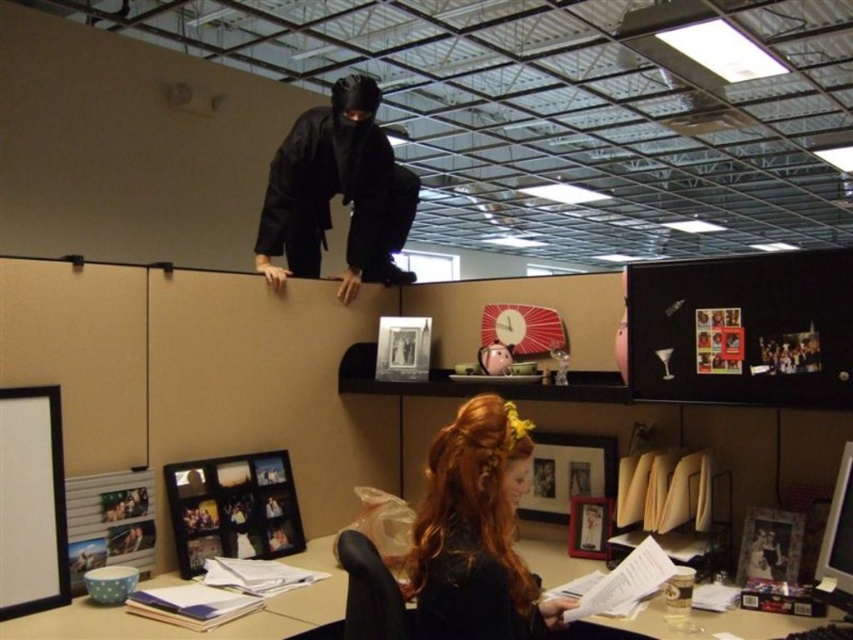
Is point (425, 577) farther from viewer compared to point (322, 180)?

No.

The image size is (853, 640). Describe the element at coordinates (476, 531) in the screenshot. I see `shiny brown hair at lower center` at that location.

Where is `shiny brown hair at lower center`? The image size is (853, 640). shiny brown hair at lower center is located at coordinates (476, 531).

Who is taller, shiny brown hair at lower center or wooden desk at lower center?

With more height is shiny brown hair at lower center.

Does shiny brown hair at lower center come in front of wooden desk at lower center?

Yes, shiny brown hair at lower center is closer to the viewer.

What do you see at coordinates (476, 531) in the screenshot?
I see `shiny brown hair at lower center` at bounding box center [476, 531].

I want to click on shiny brown hair at lower center, so click(476, 531).

Who is positioned more to the right, black matte ninja at upper center or wooden desk at lower center?

Positioned to the right is black matte ninja at upper center.

The image size is (853, 640). Describe the element at coordinates (337, 193) in the screenshot. I see `black matte ninja at upper center` at that location.

Where is `black matte ninja at upper center`? This screenshot has width=853, height=640. black matte ninja at upper center is located at coordinates (337, 193).